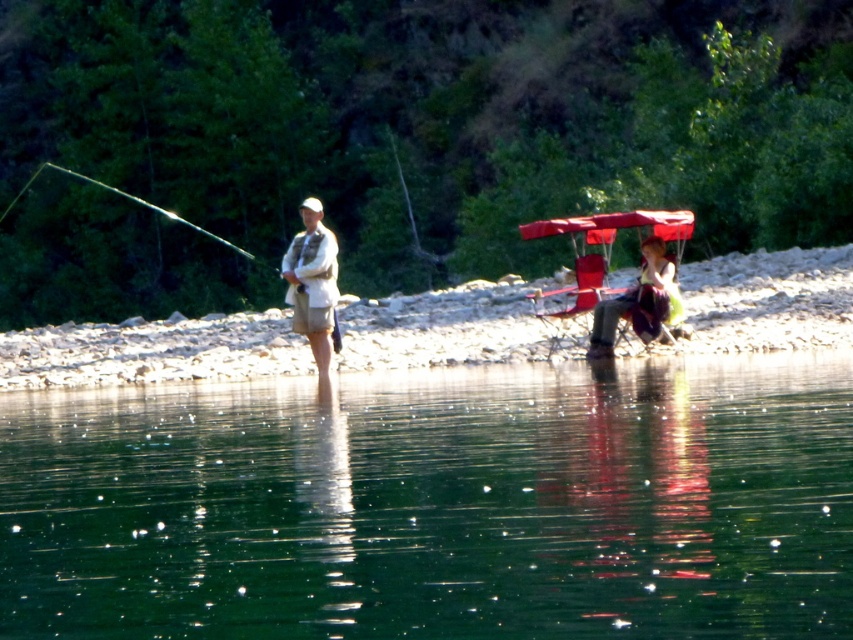
Question: Is smooth sand shore at center positioned at the back of matte red folding chair at right?

Choices:
 (A) yes
 (B) no

Answer: (A)

Question: Does matte white shirt at center lie in front of matte red umbrella at right?

Choices:
 (A) no
 (B) yes

Answer: (A)

Question: Can you confirm if green reflective water at lower center is positioned to the left of smooth sand shore at center?

Choices:
 (A) no
 (B) yes

Answer: (A)

Question: Which object is farther from the camera taking this photo?

Choices:
 (A) matte red umbrella at right
 (B) green reflective water at lower center

Answer: (A)

Question: Which point is farther to the camera?

Choices:
 (A) (625, 310)
 (B) (706, 522)
 (C) (590, 232)

Answer: (C)

Question: Which of the following is the farthest from the observer?

Choices:
 (A) green reflective water at lower center
 (B) matte white shirt at center
 (C) smooth sand shore at center

Answer: (B)